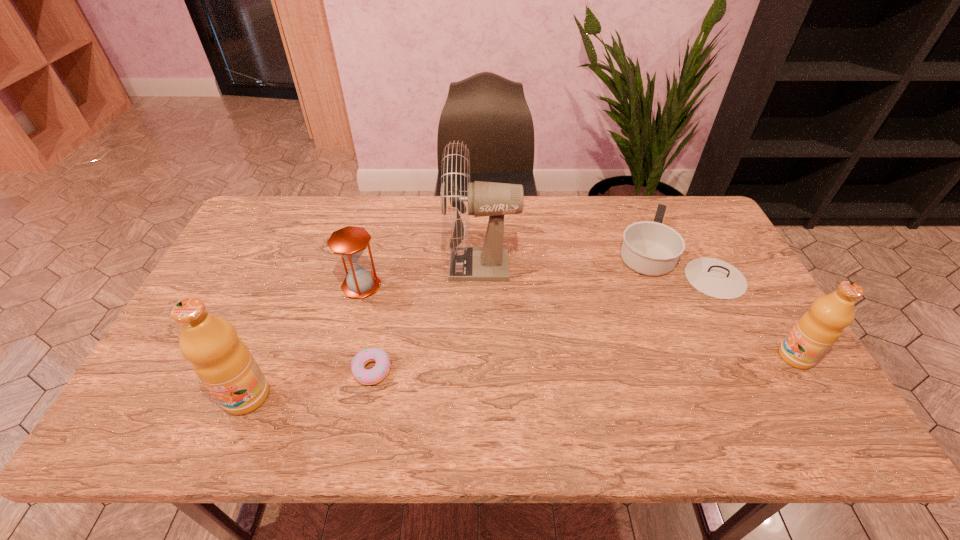
Where is `the closest object relative to the nearer fruit juice`? the closest object relative to the nearer fruit juice is located at coordinates pos(381,369).

Where is `free space that satisfies the following two spatial constraints: 1. on the front side of the saucepan; 2. on the air flow direction of the fourth object from left to right`? The height and width of the screenshot is (540, 960). free space that satisfies the following two spatial constraints: 1. on the front side of the saucepan; 2. on the air flow direction of the fourth object from left to right is located at coordinates (679, 265).

Image resolution: width=960 pixels, height=540 pixels. In order to click on free space that satisfies the following two spatial constraints: 1. on the front label of the fourth shortest object; 2. on the front label of the second tallest object in this screenshot , I will do `click(820, 396)`.